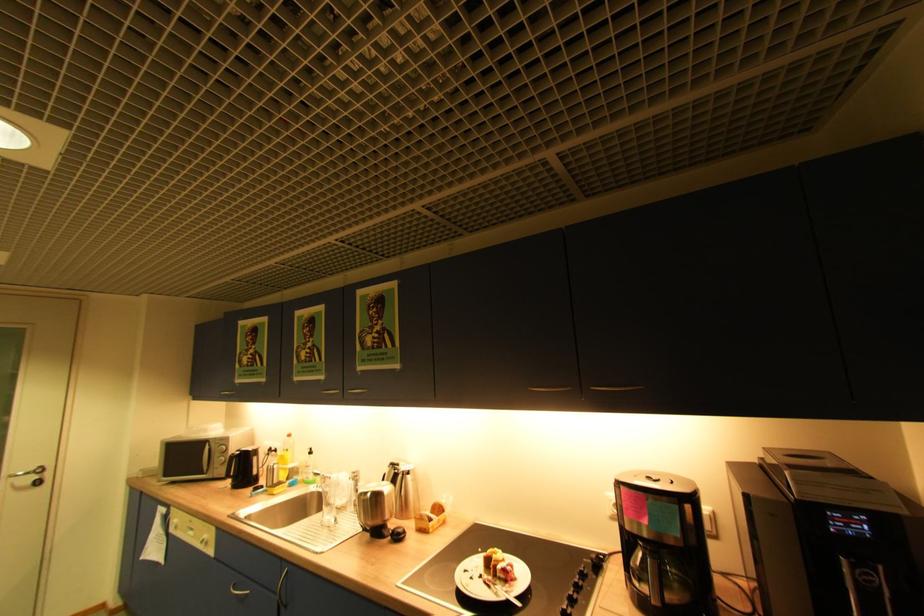
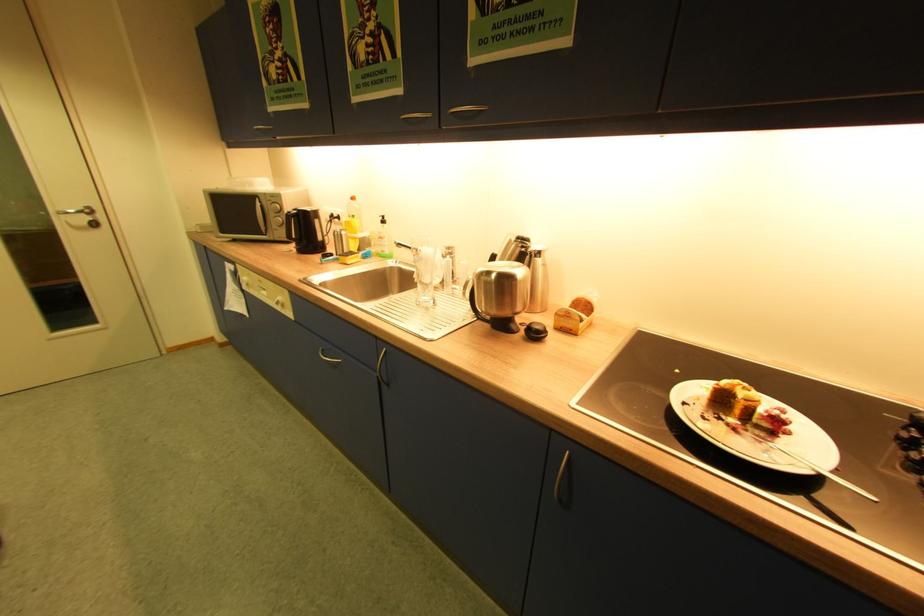
The point at (444, 509) is marked in the first image. Where is the corresponding point in the second image?

(590, 306)